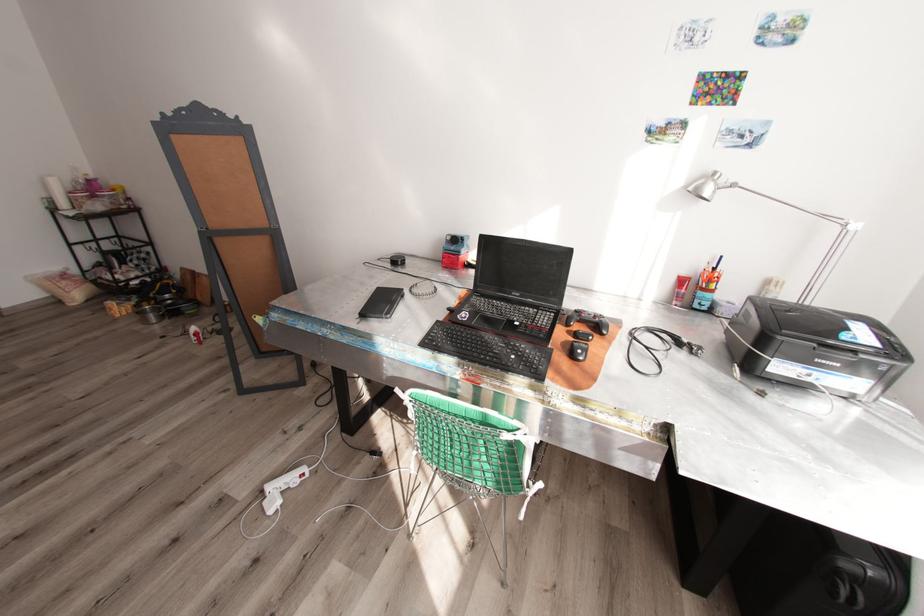
Describe the element at coordinates (824, 325) in the screenshot. This screenshot has height=616, width=924. I see `a printer scanner lid` at that location.